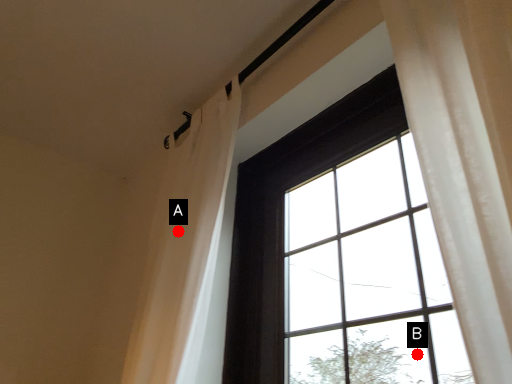
Question: Two points are circled on the image, labeled by A and B beside each circle. Which point is farther from the camera taking this photo?

Choices:
 (A) A is further
 (B) B is further

Answer: (A)